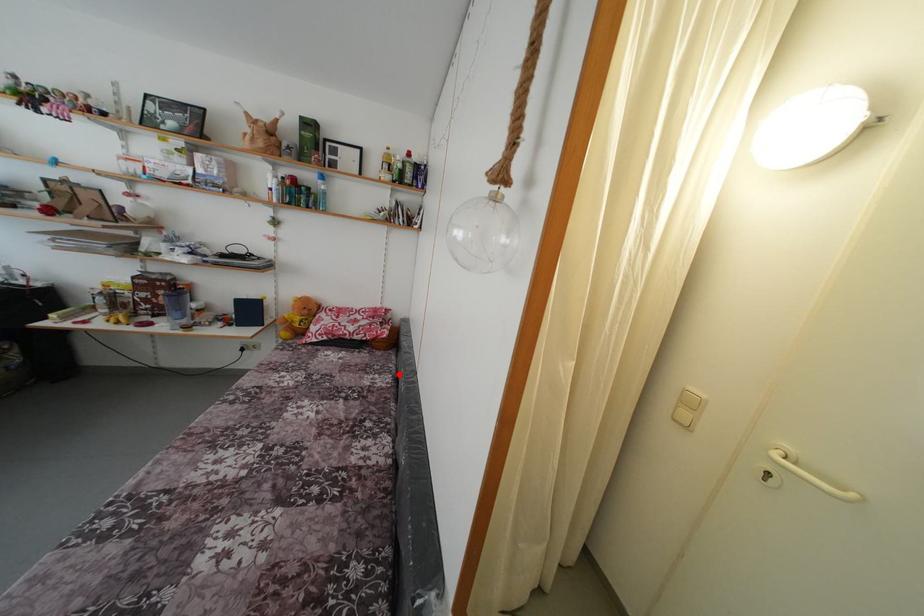
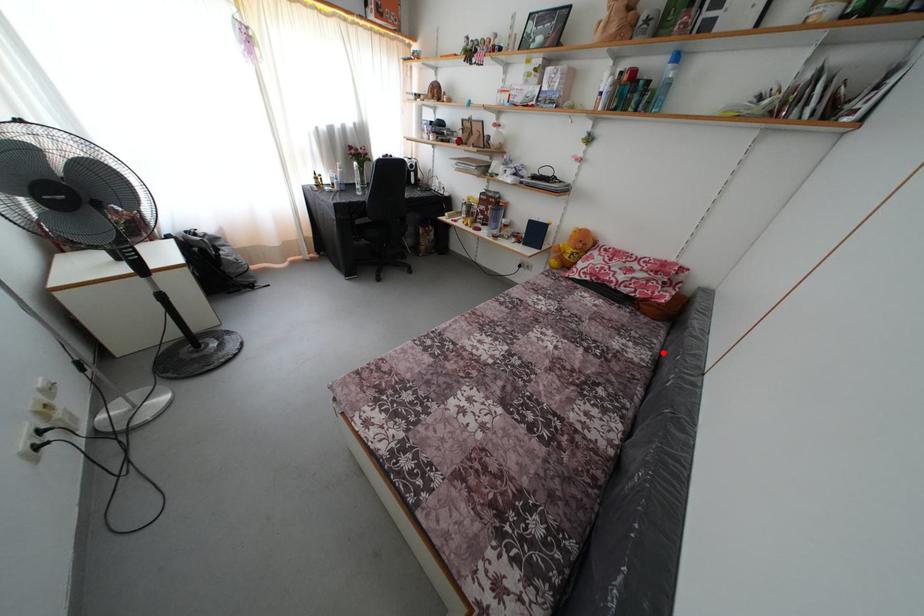
I am providing you with two images of the same scene from different viewpoints. A red point is marked on the first image and another point is marked on the second image. Does the point marked in image1 correspond to the same location as the one in image2?

Yes